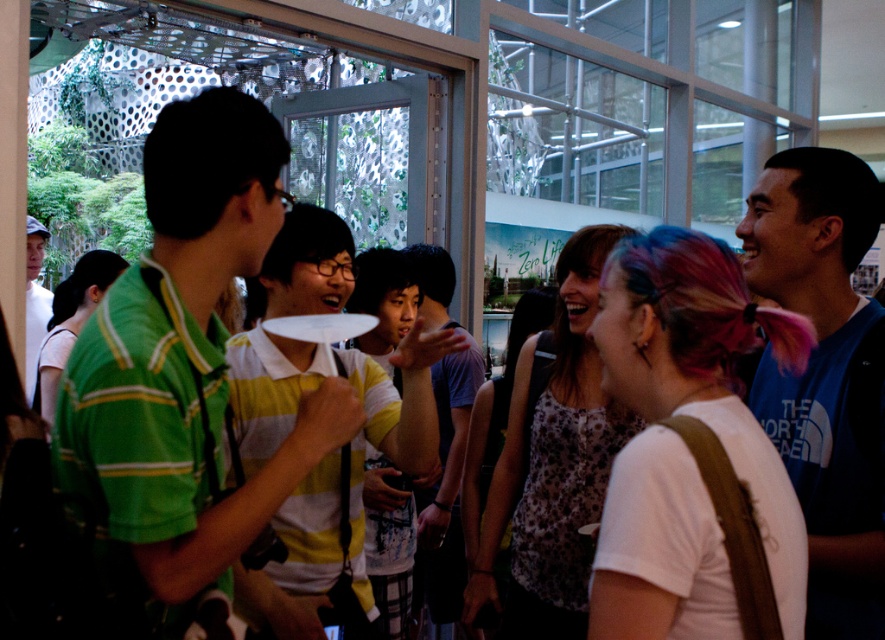
Question: Does green striped shirt at center appear under matte white cap at left?

Choices:
 (A) yes
 (B) no

Answer: (A)

Question: Which of these objects is positioned closest to the white matte t-shirt at center?

Choices:
 (A) yellow striped shirt at center
 (B) leopard print tank top at center

Answer: (B)

Question: Which of the following is the farthest from the observer?

Choices:
 (A) click(x=27, y=381)
 (B) click(x=709, y=387)
 (C) click(x=820, y=218)

Answer: (A)

Question: Based on their relative distances, which object is nearer to the leopard print tank top at center?

Choices:
 (A) blue cotton t-shirt at right
 (B) white matte t-shirt at center

Answer: (A)

Question: In this image, where is leopard print tank top at center located relative to white paper plate at center?

Choices:
 (A) above
 (B) below

Answer: (B)

Question: Does matte white cap at left appear over white paper plate at center?

Choices:
 (A) no
 (B) yes

Answer: (B)